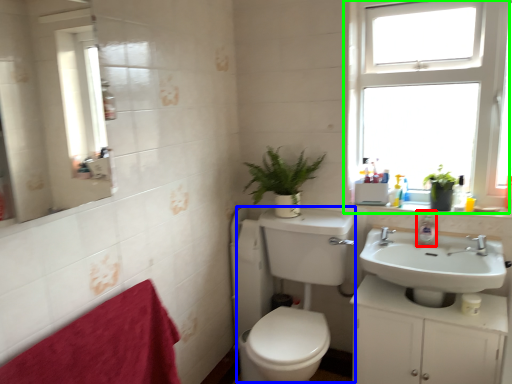
Question: Considering the real-world distances, which object is closest to soap dispenser (highlighted by a red box)? sink (highlighted by a blue box) or window (highlighted by a green box).

Choices:
 (A) sink
 (B) window

Answer: (A)